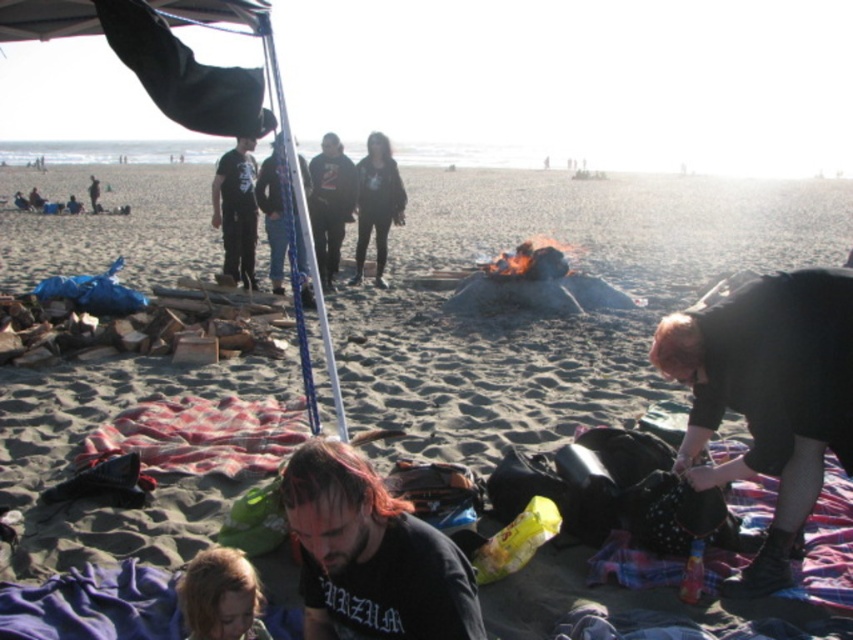
Is black cotton shirt at center shorter than dark blue jeans at center?

Indeed, black cotton shirt at center has a lesser height compared to dark blue jeans at center.

Can you confirm if black cotton shirt at center is bigger than dark blue jeans at center?

No.

Between point (245, 205) and point (306, 182), which one is positioned behind?

Positioned behind is point (306, 182).

The width and height of the screenshot is (853, 640). Find the location of `black cotton shirt at center`. black cotton shirt at center is located at coordinates (236, 211).

Can you confirm if black matte jacket at lower right is thinner than dark brown hair at center?

In fact, black matte jacket at lower right might be wider than dark brown hair at center.

Which is in front, point (733, 477) or point (403, 557)?

Point (403, 557) is in front.

Find the location of a particular element. This screenshot has height=640, width=853. black matte jacket at lower right is located at coordinates (769, 397).

Between dark gray hoodie at center and black matte jacket at center, which one has more height?

A: With more height is dark gray hoodie at center.

Where is `dark gray hoodie at center`? The height and width of the screenshot is (640, 853). dark gray hoodie at center is located at coordinates (329, 204).

Find the location of `dark gray hoodie at center`. dark gray hoodie at center is located at coordinates (329, 204).

I want to click on dark gray hoodie at center, so click(329, 204).